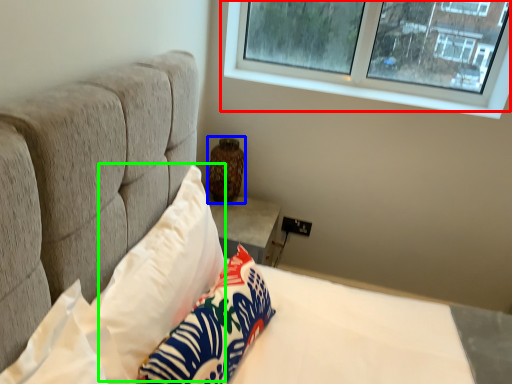
Question: Based on their relative distances, which object is farther from window (highlighted by a red box)? Choose from vase (highlighted by a blue box) and pillow (highlighted by a green box).

Choices:
 (A) vase
 (B) pillow

Answer: (B)